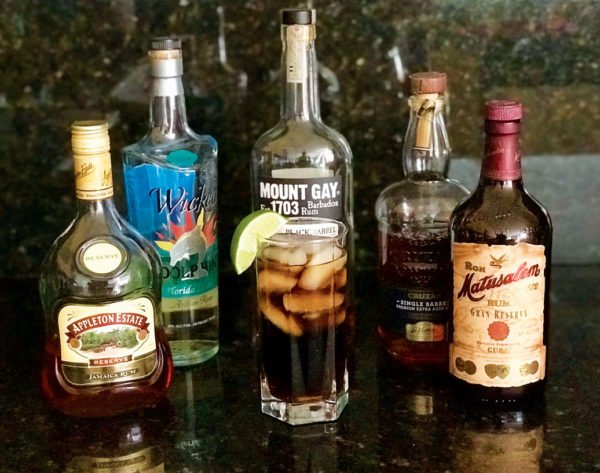
Identify the location of bottle. (417, 195).